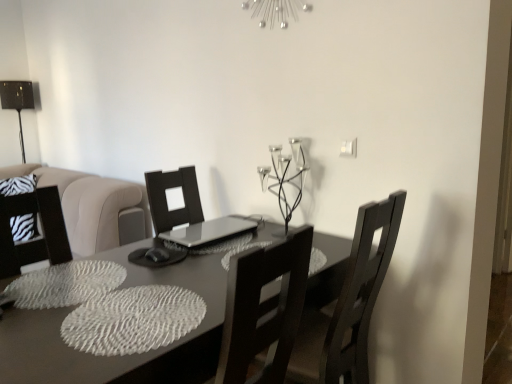
Question: Should I look upward or downward to see metallic black table lamp at left?

Choices:
 (A) down
 (B) up

Answer: (B)

Question: Is dark wood chair at center positioned with its back to matte gray table at center?

Choices:
 (A) no
 (B) yes

Answer: (B)

Question: Can you confirm if dark wood chair at center is taller than matte gray table at center?

Choices:
 (A) no
 (B) yes

Answer: (B)

Question: Can you confirm if dark wood chair at center is bigger than matte gray table at center?

Choices:
 (A) no
 (B) yes

Answer: (A)

Question: From the image's perspective, is dark wood chair at center under matte gray table at center?

Choices:
 (A) no
 (B) yes

Answer: (A)

Question: Is dark wood chair at center at the right side of matte gray table at center?

Choices:
 (A) no
 (B) yes

Answer: (B)

Question: Is dark wood chair at center smaller than matte gray table at center?

Choices:
 (A) yes
 (B) no

Answer: (A)

Question: Is silver metallic light fixture at upper center bigger than matte gray table at center?

Choices:
 (A) yes
 (B) no

Answer: (B)

Question: Is matte gray table at center at the back of silver metallic light fixture at upper center?

Choices:
 (A) no
 (B) yes

Answer: (A)

Question: From a real-world perspective, does silver metallic light fixture at upper center stand above matte gray table at center?

Choices:
 (A) yes
 (B) no

Answer: (A)

Question: Are silver metallic light fixture at upper center and matte gray table at center located far from each other?

Choices:
 (A) no
 (B) yes

Answer: (B)

Question: Is silver metallic light fixture at upper center thinner than matte gray table at center?

Choices:
 (A) no
 (B) yes

Answer: (B)

Question: From a real-world perspective, is silver metallic light fixture at upper center beneath matte gray table at center?

Choices:
 (A) yes
 (B) no

Answer: (B)

Question: Could you tell me if metallic black table lamp at left is facing dark wood chair at center?

Choices:
 (A) yes
 (B) no

Answer: (A)